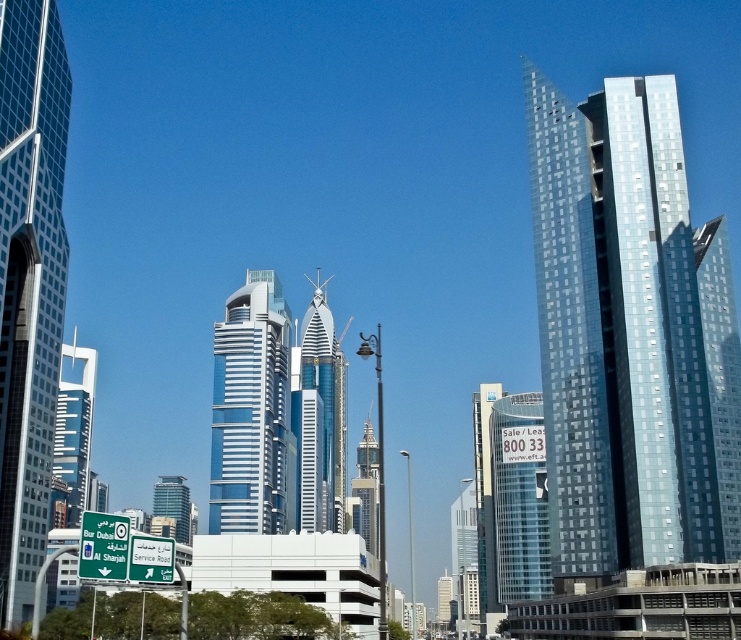
Question: Which point is farther to the camera?

Choices:
 (A) glassy blue skyscraper at center
 (B) shiny glass skyscraper at right
 (C) transparent glass building at center
 (D) glassy blue skyscraper at left

Answer: (A)

Question: Can you confirm if glassy silver skyscraper at center is thinner than shiny glass skyscraper at center?

Choices:
 (A) no
 (B) yes

Answer: (A)

Question: Estimate the real-world distances between objects in this image. Which object is farther from the shiny glass skyscraper at center?

Choices:
 (A) glassy steel skyscraper at left
 (B) shiny glass skyscraper at right
 (C) transparent glass building at center
 (D) glassy blue skyscraper at left

Answer: (A)

Question: Is glassy steel skyscraper at left below glassy blue skyscraper at left?

Choices:
 (A) yes
 (B) no

Answer: (B)

Question: Which is farther from the glassy blue skyscraper at left?

Choices:
 (A) glassy silver skyscraper at center
 (B) shiny glass skyscraper at center
 (C) transparent glass building at center

Answer: (C)

Question: Does transparent glass building at center appear over glassy blue skyscraper at left?

Choices:
 (A) no
 (B) yes

Answer: (A)